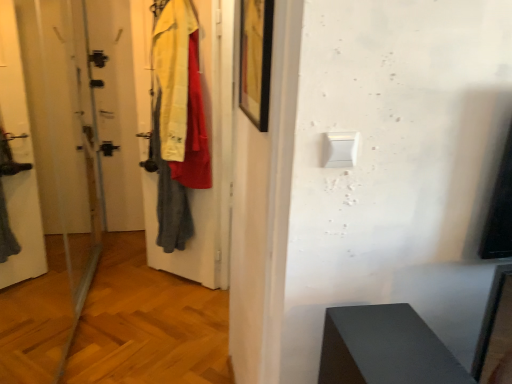
This screenshot has height=384, width=512. I want to click on black matte picture frame at upper center, so click(x=256, y=60).

Which object is wider, transparent glass screen door at left or white plastic light switch at upper center?

transparent glass screen door at left.

Is white plastic light switch at upper center surrounded by transparent glass screen door at left?

No, white plastic light switch at upper center is located outside of transparent glass screen door at left.

Which of these two, transparent glass screen door at left or white plastic light switch at upper center, stands taller?

transparent glass screen door at left.

The height and width of the screenshot is (384, 512). Identify the location of screen door below the white plastic light switch at upper center (from a real-world perspective). (61, 160).

Could you measure the distance between white plastic light switch at upper center and black matte picture frame at upper center?

white plastic light switch at upper center is 14.32 inches away from black matte picture frame at upper center.

From the image's perspective, is white plastic light switch at upper center beneath black matte picture frame at upper center?

Yes.

Who is shorter, white plastic light switch at upper center or black matte picture frame at upper center?

white plastic light switch at upper center.

Is black matte picture frame at upper center located within white plastic light switch at upper center?

No.

From a real-world perspective, is transparent glass screen door at left above or below black matte picture frame at upper center?

transparent glass screen door at left is below black matte picture frame at upper center.

This screenshot has width=512, height=384. What are the coordinates of `picture frame located above the transparent glass screen door at left (from a real-world perspective)` in the screenshot? It's located at (256, 60).

Looking at this image, is black matte picture frame at upper center far from white plastic light switch at upper center?

No, black matte picture frame at upper center is not far away from white plastic light switch at upper center.

What's the angular difference between black matte picture frame at upper center and white plastic light switch at upper center's facing directions?

They differ by 88.7 degrees in their facing directions.

Would you say white plastic light switch at upper center is part of black matte picture frame at upper center's contents?

Definitely not — white plastic light switch at upper center is not inside black matte picture frame at upper center.

From a real-world perspective, who is located lower, black matte picture frame at upper center or white plastic light switch at upper center?

white plastic light switch at upper center is physically lower.

Who is bigger, white plastic light switch at upper center or transparent glass screen door at left?

With larger size is transparent glass screen door at left.

How different are the orientations of white plastic light switch at upper center and transparent glass screen door at left in degrees?

The angle between the facing direction of white plastic light switch at upper center and the facing direction of transparent glass screen door at left is 91.1 degrees.

From a real-world perspective, is white plastic light switch at upper center physically below transparent glass screen door at left?

Actually, white plastic light switch at upper center is physically above transparent glass screen door at left in the real world.

From the picture: Which of these two, white plastic light switch at upper center or transparent glass screen door at left, is thinner?

With smaller width is white plastic light switch at upper center.

Does point (263, 119) come behind point (68, 347)?

No, (263, 119) is closer to viewer.

Based on the photo, from a real-world perspective, who is located higher, black matte picture frame at upper center or transparent glass screen door at left?

From a 3D spatial view, black matte picture frame at upper center is above.

Which is in front, black matte picture frame at upper center or transparent glass screen door at left?

transparent glass screen door at left is in front.

Where is `light switch behind the transparent glass screen door at left`? The height and width of the screenshot is (384, 512). light switch behind the transparent glass screen door at left is located at coordinates (341, 149).

This screenshot has width=512, height=384. What are the coordinates of `light switch below the black matte picture frame at upper center (from the image's perspective)` in the screenshot? It's located at (341, 149).

From the image, which object appears to be farther from black matte picture frame at upper center, transparent glass screen door at left or white plastic light switch at upper center?

Based on the image, transparent glass screen door at left appears to be further to black matte picture frame at upper center.

From the image, which object appears to be farther from black matte picture frame at upper center, white plastic light switch at upper center or transparent glass screen door at left?

Based on the image, transparent glass screen door at left appears to be further to black matte picture frame at upper center.

Considering their positions, is black matte picture frame at upper center positioned closer to white plastic light switch at upper center than transparent glass screen door at left?

black matte picture frame at upper center lies closer to white plastic light switch at upper center than the other object.

When comparing their distances from transparent glass screen door at left, does black matte picture frame at upper center or white plastic light switch at upper center seem further?

white plastic light switch at upper center lies further to transparent glass screen door at left than the other object.

When comparing their distances from white plastic light switch at upper center, does transparent glass screen door at left or black matte picture frame at upper center seem closer?

The object closer to white plastic light switch at upper center is black matte picture frame at upper center.

From the image, which object appears to be nearer to transparent glass screen door at left, white plastic light switch at upper center or black matte picture frame at upper center?

black matte picture frame at upper center is closer to transparent glass screen door at left.

Identify the location of picture frame between transparent glass screen door at left and white plastic light switch at upper center. (256, 60).